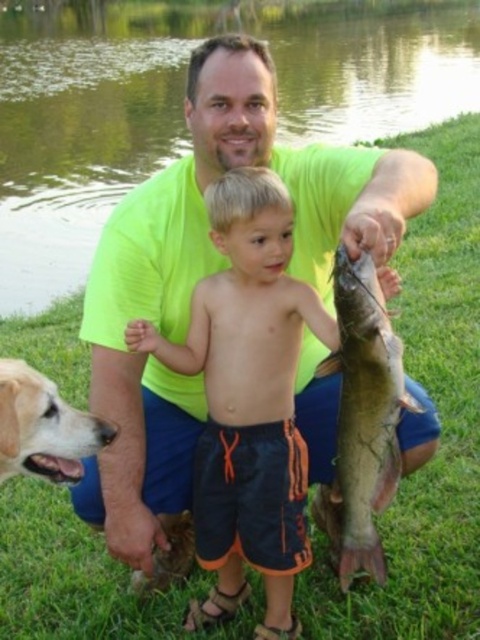
Based on the coordinates provided, which object is at point (181,104)?

The green grass at lower center is located at point (181,104).